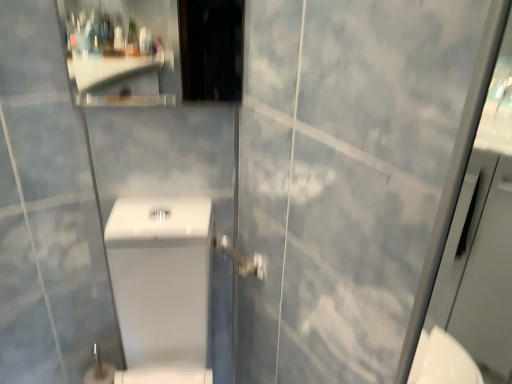
This screenshot has width=512, height=384. What do you see at coordinates (243, 259) in the screenshot?
I see `metallic silver shower handle at center` at bounding box center [243, 259].

This screenshot has height=384, width=512. What are the coordinates of `metallic silver shower handle at center` in the screenshot? It's located at (243, 259).

In order to click on metallic silver shower handle at center in this screenshot , I will do `click(243, 259)`.